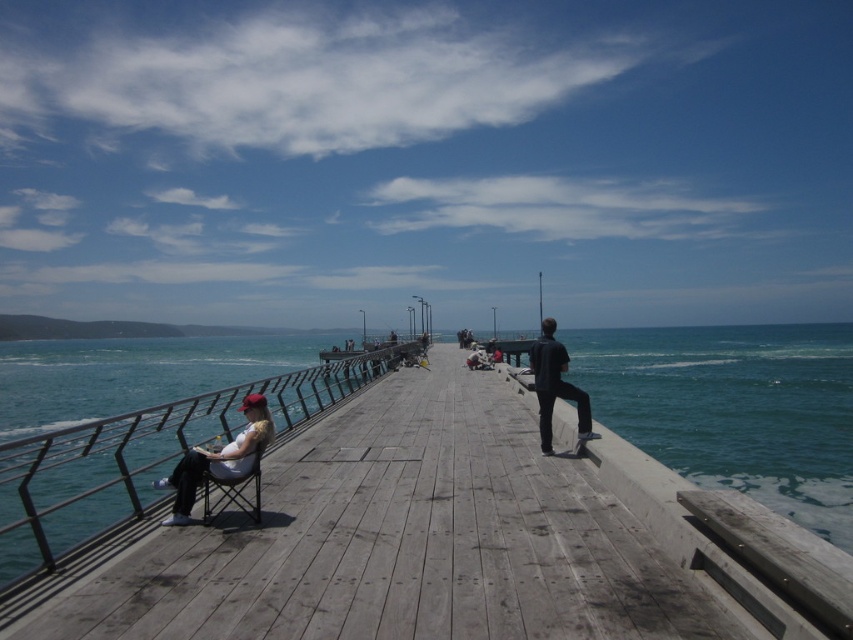
Between weathered wood dock at center and matte white folding chair at left, which one appears on the left side from the viewer's perspective?

matte white folding chair at left

Can you confirm if weathered wood dock at center is positioned above matte white folding chair at left?

Actually, weathered wood dock at center is below matte white folding chair at left.

Is point (526, 502) positioned after point (212, 506)?

No, (526, 502) is in front of (212, 506).

The height and width of the screenshot is (640, 853). What are the coordinates of `weathered wood dock at center` in the screenshot? It's located at (445, 538).

Between greenish-blue water at right and matte white folding chair at left, which one has less height?

matte white folding chair at left is shorter.

Who is more forward, [836,474] or [256,472]?

Point [256,472]

Locate an element on the screen. greenish-blue water at right is located at coordinates (734, 408).

Between weathered wood dock at center and matte white shirt at left, which one has more height?

Standing taller between the two is matte white shirt at left.

This screenshot has height=640, width=853. I want to click on weathered wood dock at center, so click(x=445, y=538).

Is point (318, 518) closer to camera compared to point (202, 464)?

No, it is not.

Locate an element on the screen. This screenshot has width=853, height=640. weathered wood dock at center is located at coordinates (445, 538).